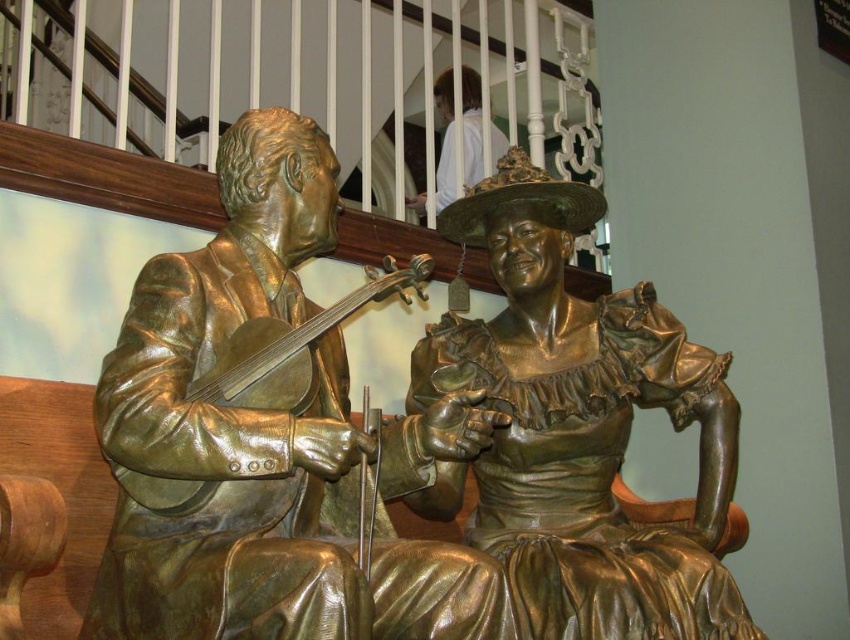
You are standing in front of the two bronze statues. The first point is at coordinates point (x=537, y=525) and the second is at point (x=452, y=179). Which point is closer to you?

Point (x=537, y=525) is closer to the viewer than point (x=452, y=179).

You are a visitor in the museum and want to take a photo of the bronze violinist at center and the white fabric at upper center in the same frame. The camera you have can capture objects up to 14 meters apart. Will you be able to capture both in one photo?

The bronze violinist at center and white fabric at upper center are 14.44 meters apart, which exceeds the camera maximum of 14 meters. You will not be able to capture both in one photo.